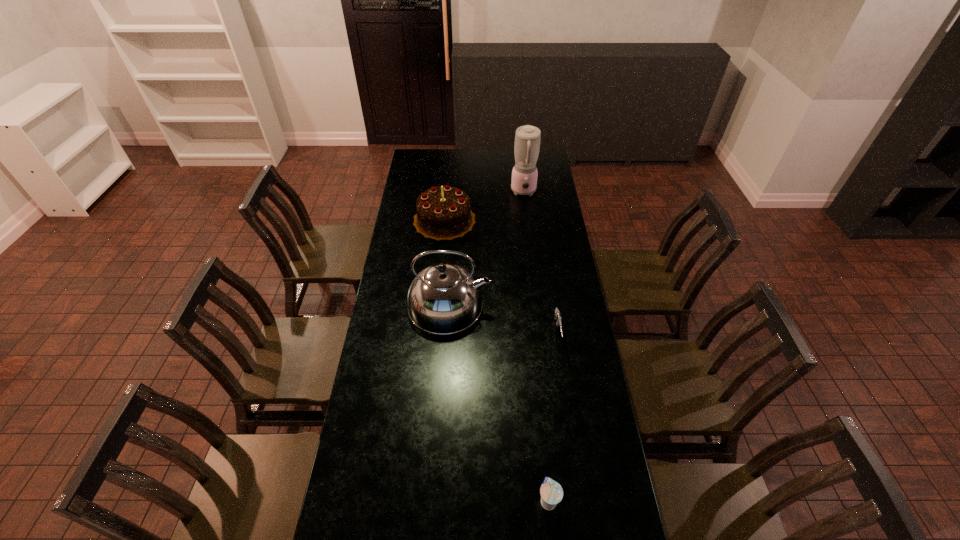
The width and height of the screenshot is (960, 540). I want to click on kettle located in the left edge section of the desktop, so (x=444, y=298).

Find the location of `birthday cake positioned at the left edge`. birthday cake positioned at the left edge is located at coordinates (443, 213).

This screenshot has width=960, height=540. Identify the location of food processor at the right edge. (527, 138).

Where is `gun located in the right edge section of the desktop`? This screenshot has height=540, width=960. gun located in the right edge section of the desktop is located at coordinates (557, 314).

You are a GUI agent. You are given a task and a screenshot of the screen. Output one action in this format:
    pyautogui.click(x=<x>, y=<y>)
    Task: Click on the vacant space at the far edge of the desktop
    
    Given the screenshot: What is the action you would take?
    pyautogui.click(x=469, y=165)

Where is `vacant region at the left edge of the desktop`? This screenshot has height=540, width=960. vacant region at the left edge of the desktop is located at coordinates (364, 395).

You are a GUI agent. You are given a task and a screenshot of the screen. Output one action in this format:
    pyautogui.click(x=<x>, y=<y>)
    Task: Click on the vacant region at the right edge of the desktop
    The height and width of the screenshot is (540, 960).
    Given the screenshot: What is the action you would take?
    pyautogui.click(x=574, y=391)

In order to click on blank space at the far left corner of the desktop in this screenshot , I will do `click(407, 170)`.

At what (x,y) coordinates should I click in order to perform the action: click on empty location between the tallest object and the kettle. Please return your answer as a coordinate pair (x, y). The image size is (960, 540). Looking at the image, I should click on (487, 248).

The image size is (960, 540). I want to click on blank region between the gun and the third shortest object, so click(501, 276).